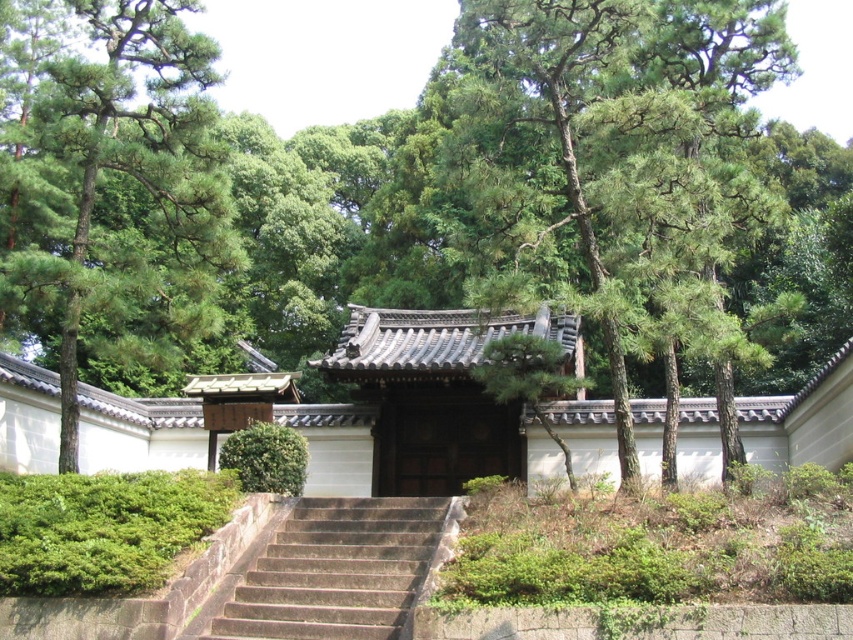
Question: Which point is farther from the camera taking this photo?

Choices:
 (A) (433, 538)
 (B) (149, 20)

Answer: (B)

Question: Which point appears closest to the camera in this image?

Choices:
 (A) (194, 84)
 (B) (405, 516)

Answer: (B)

Question: Is green leafy tree at left to the left of brown stone stairs at center from the viewer's perspective?

Choices:
 (A) no
 (B) yes

Answer: (B)

Question: Is green leafy tree at left wider than brown stone stairs at center?

Choices:
 (A) yes
 (B) no

Answer: (A)

Question: Which object appears closest to the camera in this image?

Choices:
 (A) green leafy tree at left
 (B) brown stone stairs at center

Answer: (B)

Question: Observing the image, what is the correct spatial positioning of green leafy tree at left in reference to brown stone stairs at center?

Choices:
 (A) above
 (B) below

Answer: (A)